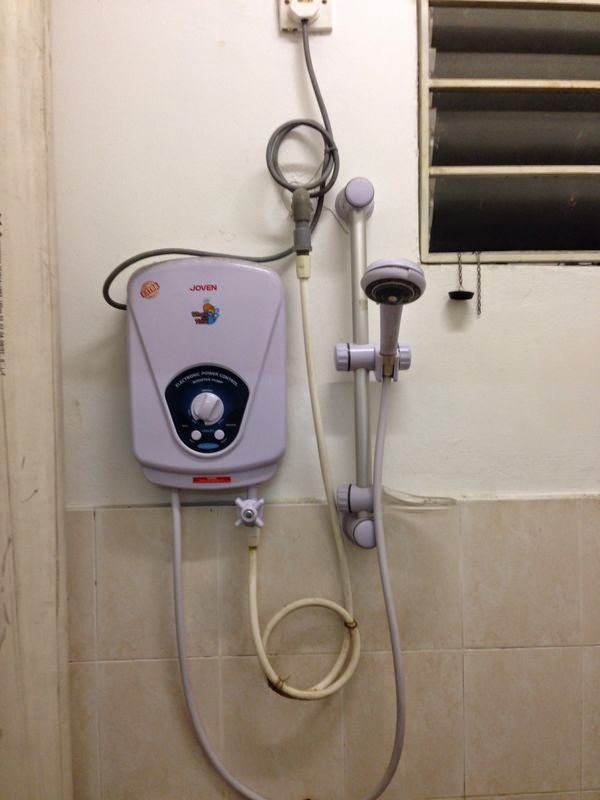
Find the location of a particular element. The image size is (600, 800). white wall is located at coordinates (199, 160).